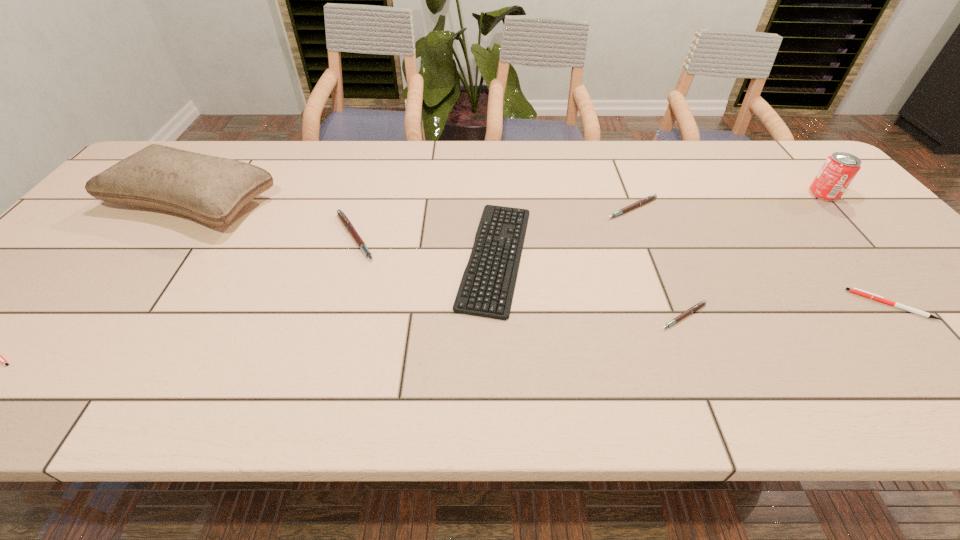
Locate an element on the screen. the tallest object is located at coordinates (211, 189).

The image size is (960, 540). Find the location of `taupe cushion`. taupe cushion is located at coordinates (211, 189).

Identify the location of can. Image resolution: width=960 pixels, height=540 pixels. (839, 169).

This screenshot has height=540, width=960. What are the coordinates of `the second tallest object` in the screenshot? It's located at (839, 169).

The image size is (960, 540). What are the coordinates of `the leftmost pink pen` in the screenshot? It's located at (346, 222).

At what (x,y) coordinates should I click in order to perform the action: click on the tallest pen. Please return your answer as a coordinate pair (x, y). The height and width of the screenshot is (540, 960). Looking at the image, I should click on (346, 222).

The height and width of the screenshot is (540, 960). I want to click on the second smallest pink pen, so click(647, 199).

Where is `the fourth object from left to right`? the fourth object from left to right is located at coordinates (487, 286).

Identify the location of the smallest pink pen. (694, 308).

Where is `the farther white pen`? This screenshot has width=960, height=540. the farther white pen is located at coordinates (854, 290).